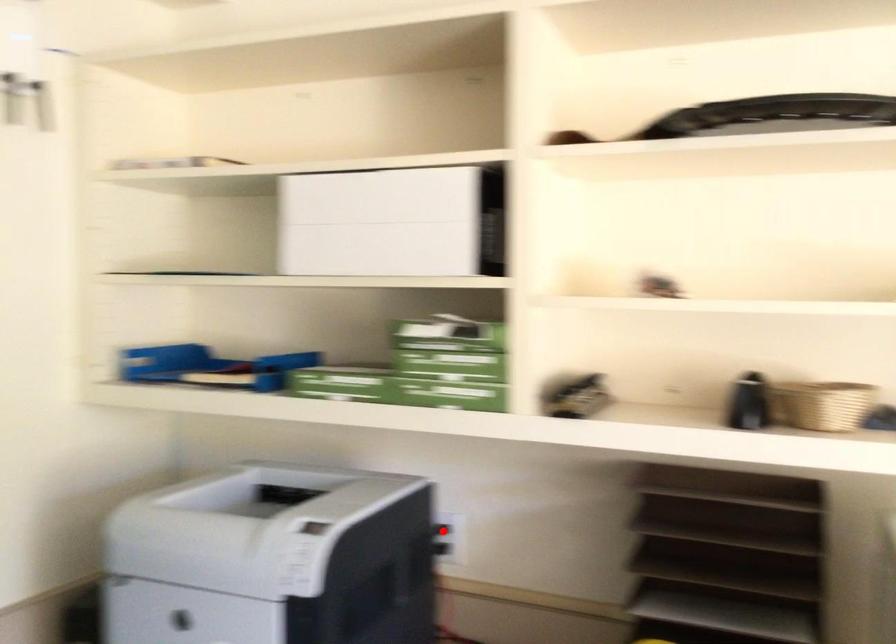
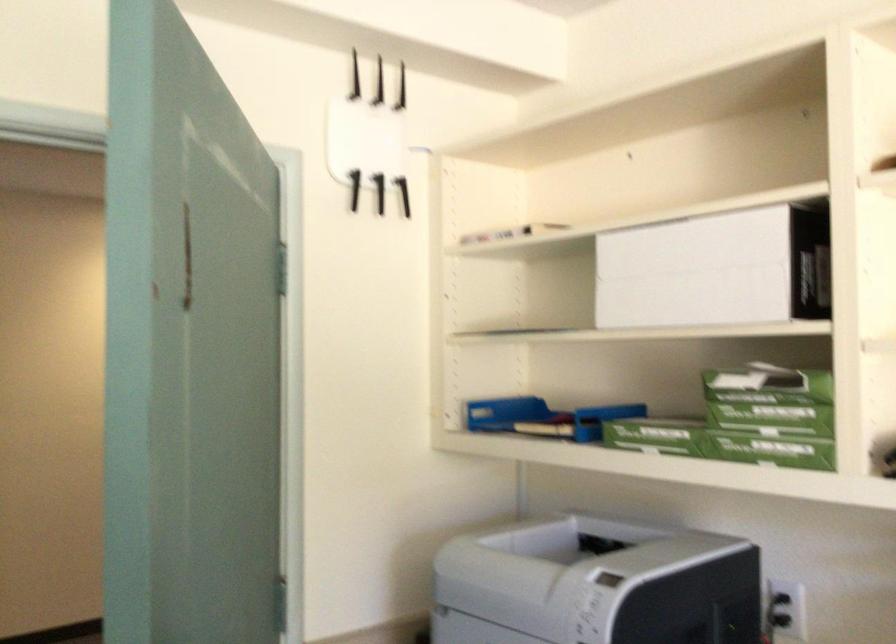
Question: I am providing you with two images of the same scene from different viewpoints. In image1, a red point is highlighted. Considering the same 3D point in image2, which of the following is correct?

Choices:
 (A) It is closer
 (B) It is farther

Answer: (A)